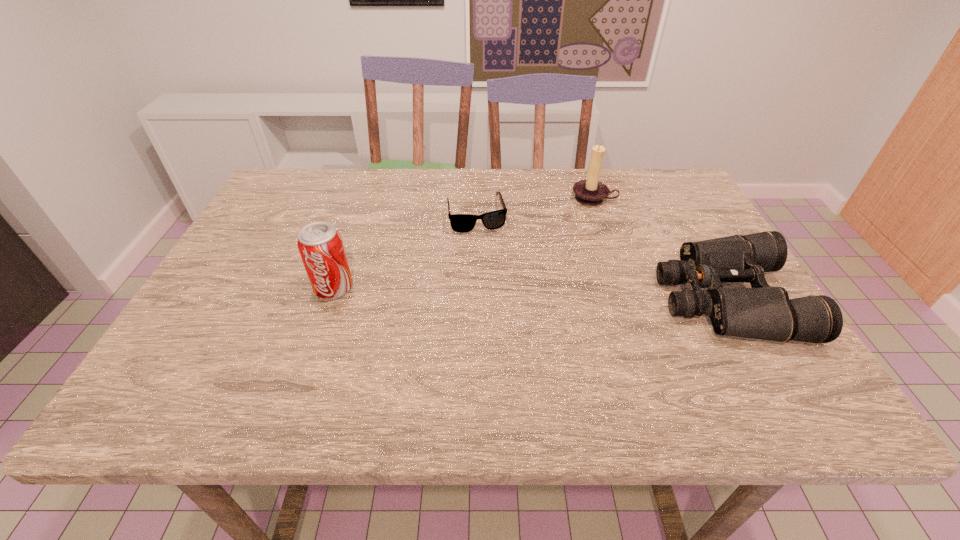
Locate an element on the screen. The width and height of the screenshot is (960, 540). object present at the near right corner is located at coordinates (765, 312).

Find the location of a particular element. The width and height of the screenshot is (960, 540). free space at the far edge is located at coordinates (335, 186).

Find the location of `free region at the near edge of the desktop`. free region at the near edge of the desktop is located at coordinates (369, 346).

Locate an element on the screen. This screenshot has height=540, width=960. free space at the left edge of the desktop is located at coordinates (278, 284).

At what (x,y) coordinates should I click in order to perform the action: click on vacant space at the right edge of the desktop. Please return your answer as a coordinate pair (x, y). The height and width of the screenshot is (540, 960). Looking at the image, I should click on (700, 231).

The width and height of the screenshot is (960, 540). I want to click on vacant space at the far left corner of the desktop, so click(300, 181).

The width and height of the screenshot is (960, 540). In the image, there is a desktop. In order to click on free space at the near right corner in this screenshot , I will do `click(738, 341)`.

Find the location of a particular element. The width and height of the screenshot is (960, 540). free space that is in between the soda can and the sunglasses is located at coordinates (405, 251).

You are a GUI agent. You are given a task and a screenshot of the screen. Output one action in this format:
    pyautogui.click(x=<x>, y=<y>)
    Task: Click on the vacant point located between the second object from left to right and the third object from left to right
    The image size is (960, 540).
    Given the screenshot: What is the action you would take?
    pyautogui.click(x=535, y=206)

At what (x,y) coordinates should I click in order to perform the action: click on free space between the binoculars and the candle holder. Please return your answer as a coordinate pair (x, y). Looking at the image, I should click on (660, 249).